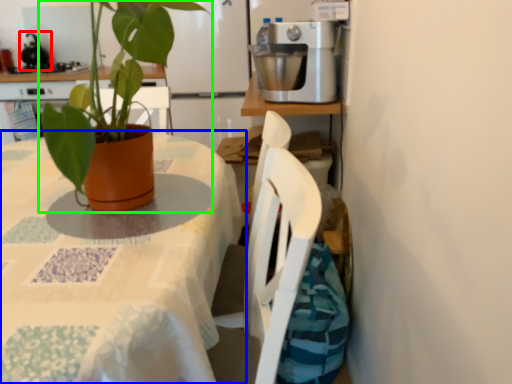
Question: Estimate the real-world distances between objects in this image. Which object is closer to mixer (highlighted by a red box), table (highlighted by a blue box) or houseplant (highlighted by a green box)?

Choices:
 (A) table
 (B) houseplant

Answer: (A)